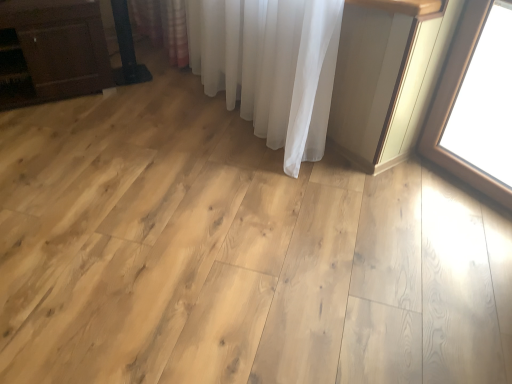
Question: Based on their positions, is matte brown cabinet at left located to the left or right of white sheer curtain at center?

Choices:
 (A) right
 (B) left

Answer: (B)

Question: From a real-world perspective, is matte brown cabinet at left physically located above or below white sheer curtain at center?

Choices:
 (A) above
 (B) below

Answer: (B)

Question: In terms of width, does matte brown cabinet at left look wider or thinner when compared to white sheer curtain at center?

Choices:
 (A) thin
 (B) wide

Answer: (B)

Question: Relative to matte brown cabinet at left, is white sheer curtain at center in front or behind?

Choices:
 (A) behind
 (B) front

Answer: (B)

Question: From the image's perspective, is white sheer curtain at center positioned above or below matte brown cabinet at left?

Choices:
 (A) above
 (B) below

Answer: (A)

Question: Is point (194, 33) closer or farther from the camera than point (40, 82)?

Choices:
 (A) farther
 (B) closer

Answer: (A)

Question: Based on their sizes in the image, would you say white sheer curtain at center is bigger or smaller than matte brown cabinet at left?

Choices:
 (A) small
 (B) big

Answer: (B)